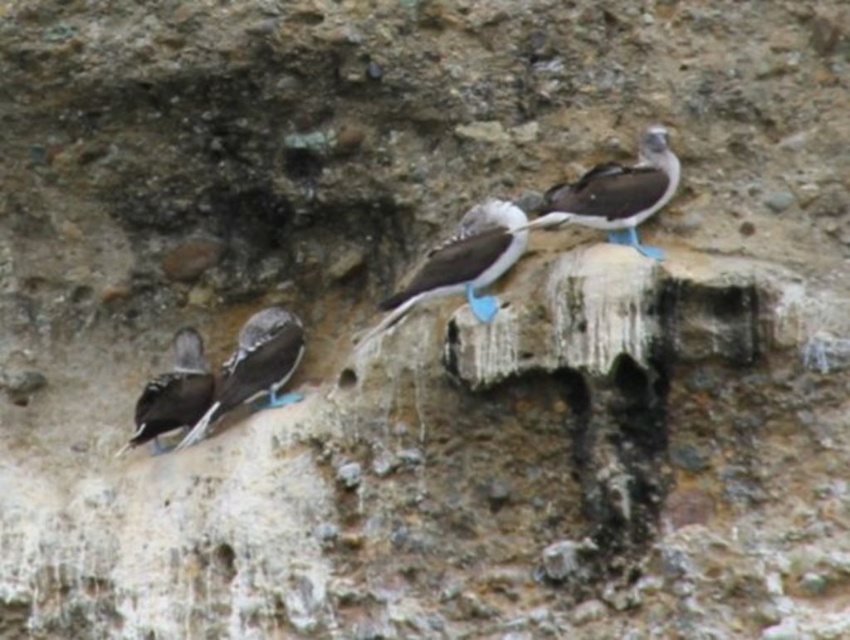
You are a birdwatcher observing the scene. You notice two birds in particular. One is the white feathered bird at center and the other is the shiny black feathers at left. Which of these two birds is shorter in height?

The white feathered bird at center is shorter than the shiny black feathers at left.

You are a birdwatcher observing the scene. You notice two birds in particular. The first is a white feathered bird at center, and the second is a shiny black feathers at left. Which bird is located higher up in the image?

The white feathered bird at center is positioned over shiny black feathers at left, so it is higher up in the image.